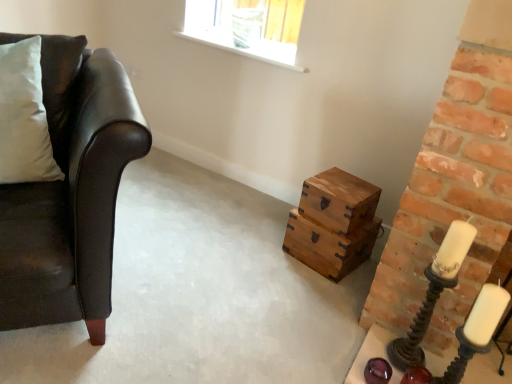
Where is `vacant space in between matte black leather couch at left and metallic spiral candle holder at right, the second candle holder in the right-to-left sequence`? vacant space in between matte black leather couch at left and metallic spiral candle holder at right, the second candle holder in the right-to-left sequence is located at coordinates (224, 308).